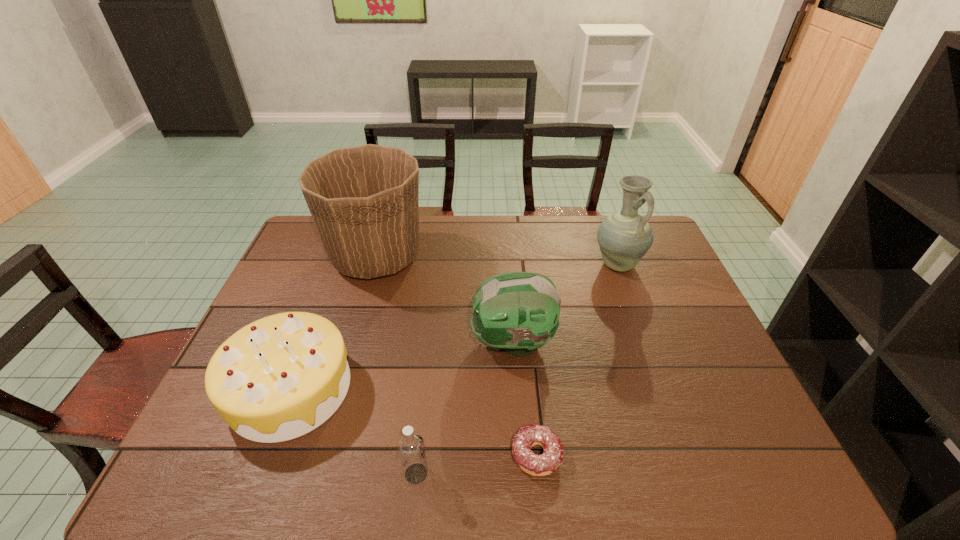
Image resolution: width=960 pixels, height=540 pixels. I want to click on vacant space located on the visor of the fourth shortest object, so click(449, 342).

You are a GUI agent. You are given a task and a screenshot of the screen. Output one action in this format:
    pyautogui.click(x=<x>, y=<y>)
    Task: Click on the vacant space located 0.090m on the right of the birthday cake
    This screenshot has width=960, height=540.
    Given the screenshot: What is the action you would take?
    pyautogui.click(x=387, y=388)

Locate an element on the screen. free space located on the front label of the vodka is located at coordinates (475, 474).

The image size is (960, 540). What are the coordinates of `blank space located 0.400m on the right of the shortest object` in the screenshot? It's located at (741, 455).

Find the location of a particular element. The height and width of the screenshot is (540, 960). flowerpot positioned at the far edge is located at coordinates (363, 200).

I want to click on pitcher located in the far edge section of the desktop, so click(624, 237).

Locate an element on the screen. birthday cake that is at the near edge is located at coordinates (280, 377).

Identify the location of vodka that is at the near edge. The width and height of the screenshot is (960, 540). (411, 448).

Where is `doughnut that is positioned at the near edge`? doughnut that is positioned at the near edge is located at coordinates (528, 436).

This screenshot has width=960, height=540. I want to click on flowerpot situated at the left edge, so click(363, 200).